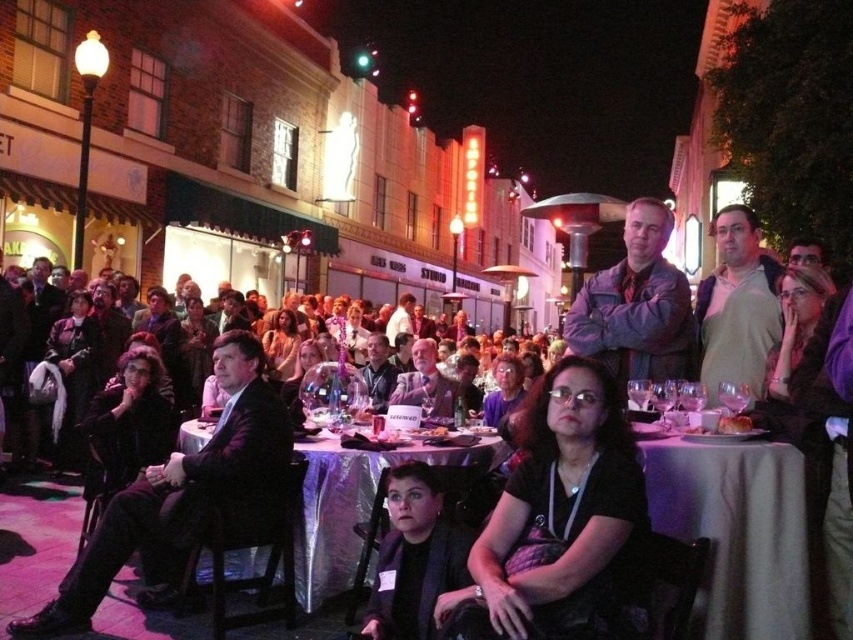
Question: Is black fabric at center to the right of black suit at left from the viewer's perspective?

Choices:
 (A) yes
 (B) no

Answer: (A)

Question: Which point is farther to the camera?

Choices:
 (A) (712, 378)
 (B) (312, 572)
 (C) (521, 554)

Answer: (A)

Question: Can you confirm if denim jacket at center is positioned to the left of dark gray shirt at center?

Choices:
 (A) no
 (B) yes

Answer: (A)

Question: Which object is positioned closest to the denim jacket at center?

Choices:
 (A) dark gray suit at center
 (B) black fabric at center
 (C) silver metallic table at center
 (D) dark gray shirt at center

Answer: (B)

Question: Is black suit at left positioned behind light brown sweater at center?

Choices:
 (A) yes
 (B) no

Answer: (B)

Question: Which of the following is the farthest from the observer?

Choices:
 (A) (646, 280)
 (B) (428, 508)
 (C) (570, 403)
 (D) (177, 436)

Answer: (A)